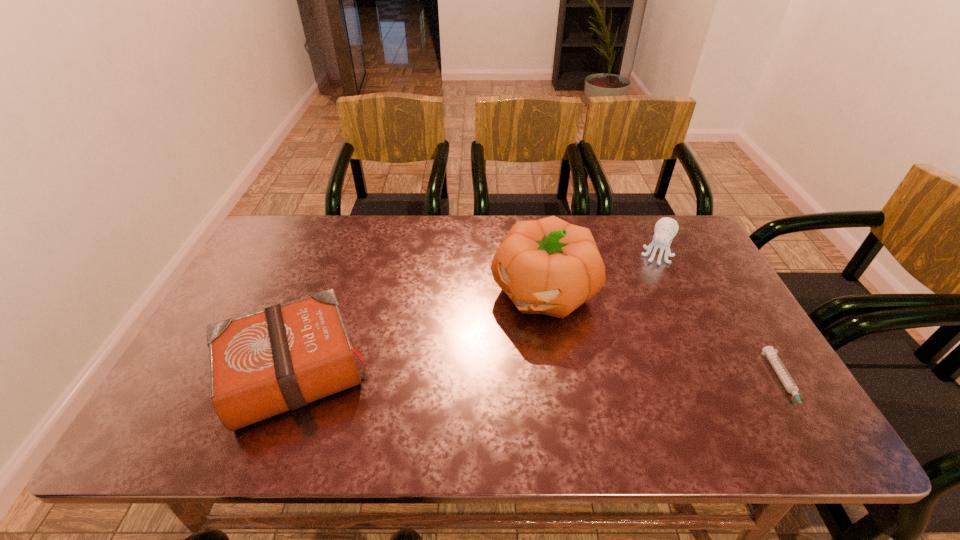
The width and height of the screenshot is (960, 540). What are the coordinates of `object positioned at the near left corner` in the screenshot? It's located at (262, 364).

Where is `object that is positioned at the far right corner`? The image size is (960, 540). object that is positioned at the far right corner is located at coordinates (666, 228).

Find the location of `object that is at the near right corner`. object that is at the near right corner is located at coordinates (789, 384).

This screenshot has height=540, width=960. Identify the location of vacant space at the far edge of the desktop. (372, 246).

The image size is (960, 540). I want to click on free location at the right edge, so click(680, 278).

In order to click on vacant space at the far left corner of the desktop in this screenshot , I will do coord(278,216).

You are a GUI agent. You are given a task and a screenshot of the screen. Output one action in this format:
    pyautogui.click(x=<x>, y=<y>)
    Task: Click on the free space between the second object from right to left and the leftmost object
    This screenshot has height=540, width=960.
    Given the screenshot: What is the action you would take?
    pyautogui.click(x=474, y=314)

Find the location of `vacant area between the pumpkin and the Bible`. vacant area between the pumpkin and the Bible is located at coordinates (418, 332).

The height and width of the screenshot is (540, 960). In order to click on free area in between the leftmost object and the second object from right to left in this screenshot , I will do `click(474, 314)`.

The height and width of the screenshot is (540, 960). I want to click on free space between the octopus and the syringe, so click(x=720, y=320).